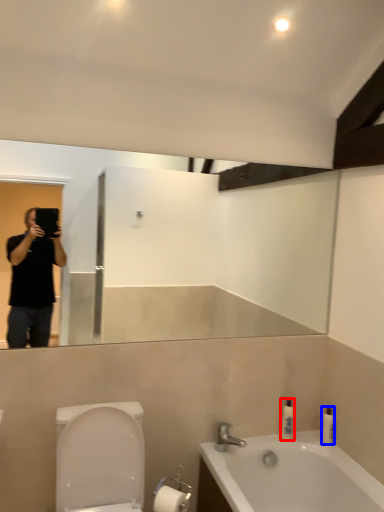
Question: Which object appears farthest to the camera in this image, toiletry (highlighted by a red box) or toiletry (highlighted by a blue box)?

Choices:
 (A) toiletry
 (B) toiletry

Answer: (A)